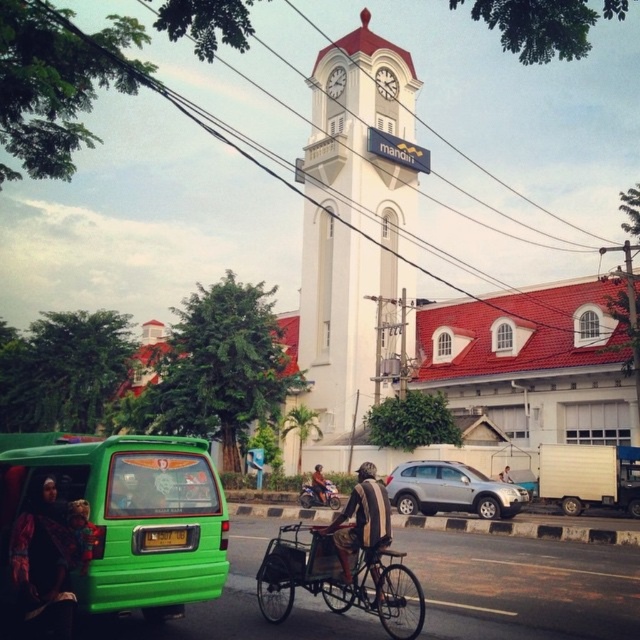
This screenshot has width=640, height=640. What do you see at coordinates (339, 580) in the screenshot?
I see `rustic wooden cart at center` at bounding box center [339, 580].

Identify the location of rustic wooden cart at center. (339, 580).

Can you confirm if silver metallic suv at center is thinner than orange fabric helmet at center?

No, silver metallic suv at center is not thinner than orange fabric helmet at center.

Can you confirm if silver metallic suv at center is positioned to the right of orange fabric helmet at center?

Yes, silver metallic suv at center is to the right of orange fabric helmet at center.

Find the location of a particular element. silver metallic suv at center is located at coordinates (451, 490).

Locate an element on the screen. silver metallic suv at center is located at coordinates (451, 490).

Is point (333, 76) positioned after point (257, 595)?

Yes, it is behind point (257, 595).

Does point (362, 54) lie in front of point (321, 556)?

No, (362, 54) is behind (321, 556).

Between point (390, 275) and point (278, 611), which one is positioned behind?

Point (390, 275)

This screenshot has width=640, height=640. What are the coordinates of `white smooth clock tower at center` in the screenshot? It's located at (355, 218).